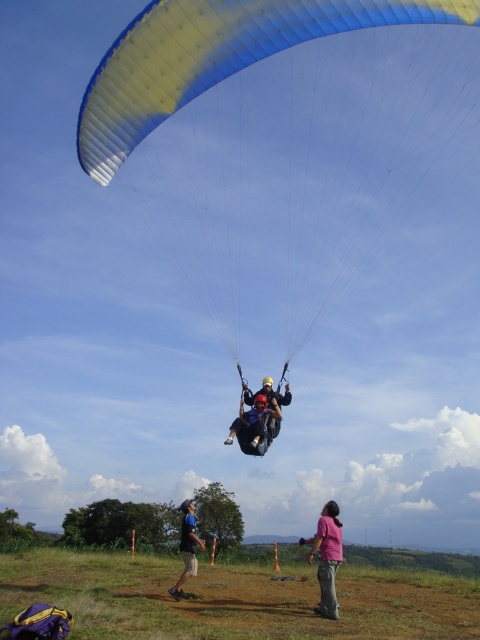
Question: Which object appears closest to the camera in this image?

Choices:
 (A) pink fabric pants at lower center
 (B) blue/yellow fabric parachute at upper center

Answer: (B)

Question: Considering the real-world distances, which object is farthest from the blue fabric parachute at upper center?

Choices:
 (A) matte black helmet at center
 (B) blue/yellow fabric parachute at upper center
 (C) pink fabric pants at lower center
 (D) matte blue helmet at center

Answer: (B)

Question: Which of these objects is positioned closest to the matte black helmet at center?

Choices:
 (A) pink fabric pants at lower center
 (B) blue fabric parachute at upper center
 (C) matte blue helmet at center

Answer: (C)

Question: Can you confirm if pink fabric pants at lower center is positioned to the right of matte black helmet at center?

Choices:
 (A) no
 (B) yes

Answer: (B)

Question: Is blue/yellow fabric parachute at upper center in front of blue fabric parachute at upper center?

Choices:
 (A) no
 (B) yes

Answer: (B)

Question: From the image, what is the correct spatial relationship of pink fabric pants at lower center in relation to matte blue helmet at center?

Choices:
 (A) left
 (B) right

Answer: (B)